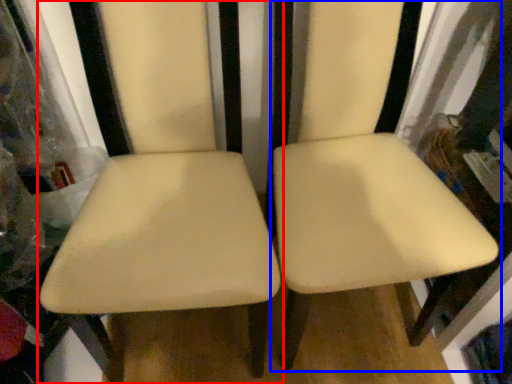
Question: Which point is closer to the camera, chair (highlighted by a red box) or chair (highlighted by a blue box)?

Choices:
 (A) chair
 (B) chair

Answer: (A)